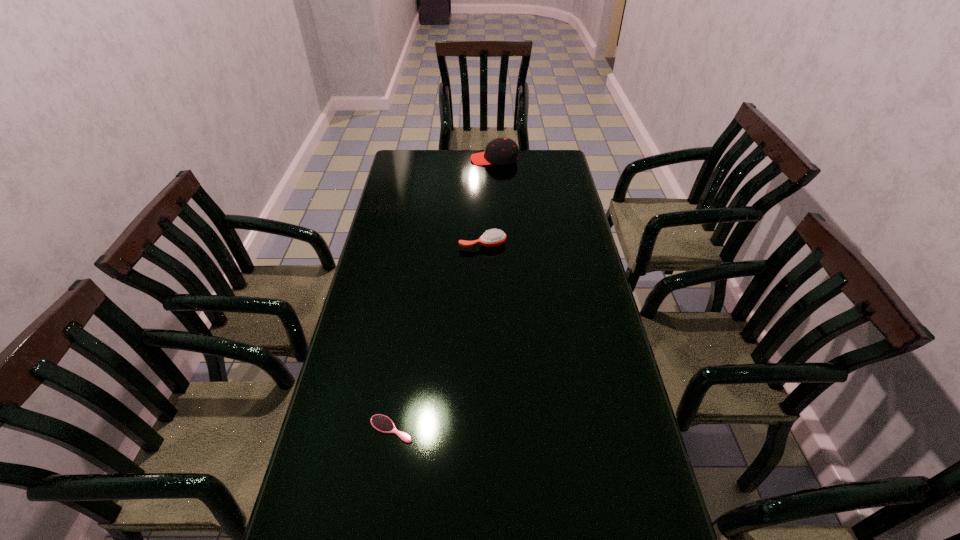
I want to click on unoccupied area between the tallest object and the farther hairbrush, so click(x=489, y=202).

The image size is (960, 540). I want to click on free space between the taller hairbrush and the farthest object, so click(x=489, y=202).

Where is `free space between the shorter hairbrush and the second farthest object`? The width and height of the screenshot is (960, 540). free space between the shorter hairbrush and the second farthest object is located at coordinates (437, 336).

Where is `vacant space that is in between the tallest object and the second nearest object`? vacant space that is in between the tallest object and the second nearest object is located at coordinates (489, 202).

Identify the location of blank region between the tallest object and the shortest object. This screenshot has height=540, width=960. (443, 294).

Locate an element on the screen. This screenshot has width=960, height=540. unoccupied position between the taller hairbrush and the tallest object is located at coordinates (489, 202).

Locate an element on the screen. vacant area that lies between the second nearest object and the left hairbrush is located at coordinates (437, 336).

Identify the location of blank region between the shortest object and the cap. The image size is (960, 540). (443, 294).

Image resolution: width=960 pixels, height=540 pixels. What are the coordinates of `object that is the closest to the cap` in the screenshot? It's located at (494, 237).

Find the location of a particular element. Image resolution: width=960 pixels, height=540 pixels. the second closest object to the tallest object is located at coordinates (382, 423).